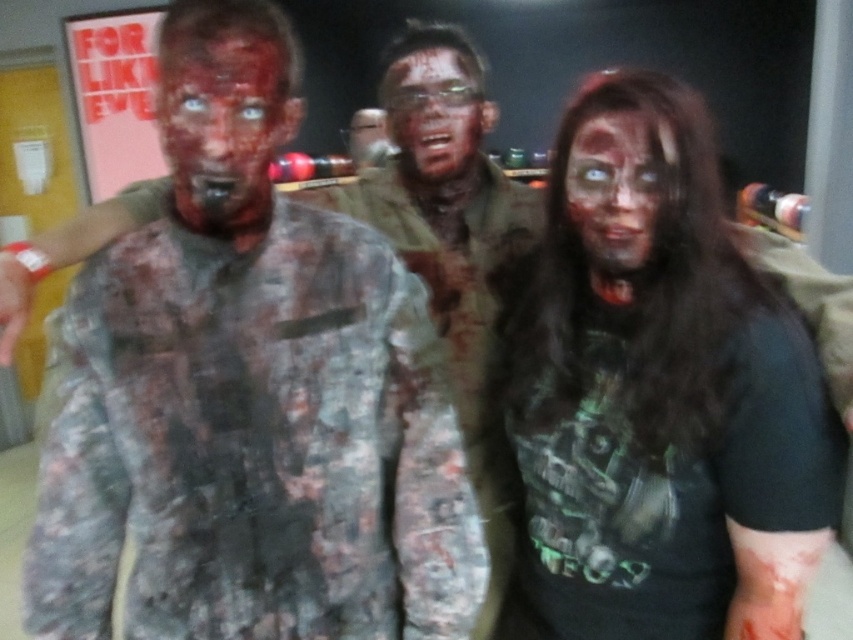
You are a photographer at the event and need to capture a closeup of the matte skin face at center without including the matte blood at center in the frame. Is this possible given their relative sizes?

The matte blood at center might be wider than matte skin face at center, so there is a possibility that the blood could extend beyond the face and into the frame, making it difficult to exclude entirely. Adjust the camera angle or cropping to focus solely on the matte skin face at center.

You are a photographer standing at a distance of 30 inches from the camouflage uniform at center. Can you reach it to adjust its position?

The camouflage uniform at center is 31.99 inches from the viewer, so you are 0.99 inches too far to reach it.

Based on the scene description, can you determine if the camouflage uniform at center is wider than the matte skin face at center?

The camouflage uniform at center is wider than the matte skin face at center according to the description provided.